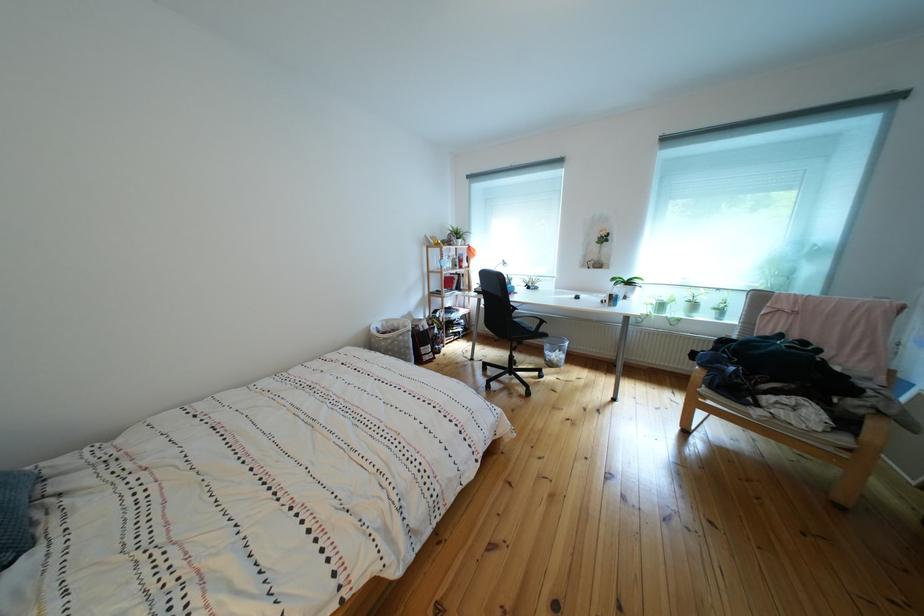
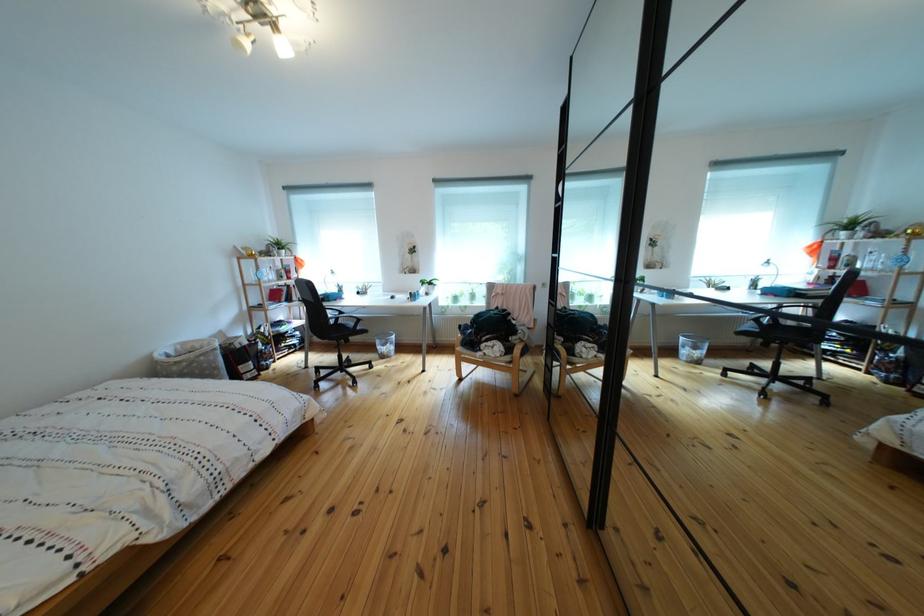
The point at (394, 331) is marked in the first image. Where is the corresponding point in the second image?

(187, 355)